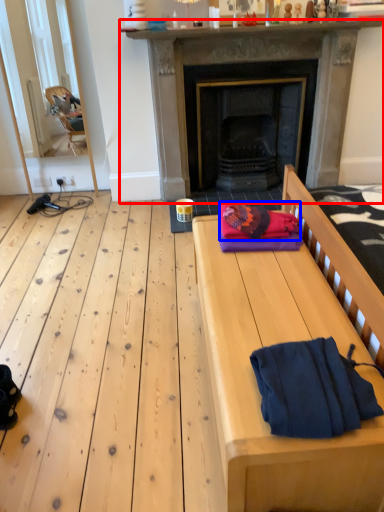
Question: Which object is further to the camera taking this photo, fireplace (highlighted by a red box) or blanket (highlighted by a blue box)?

Choices:
 (A) fireplace
 (B) blanket

Answer: (A)